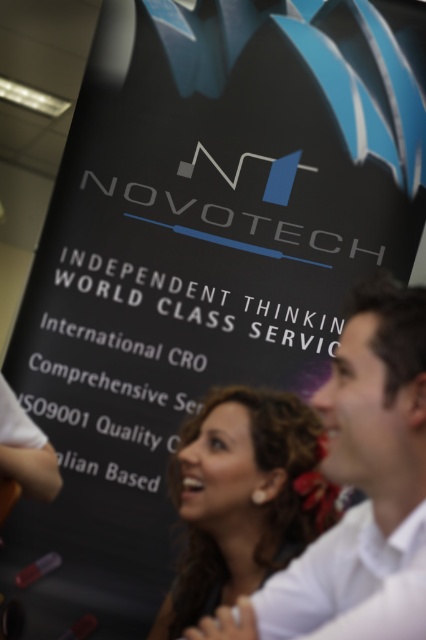
Question: Which point is closer to the camera taking this photo?

Choices:
 (A) (359, 346)
 (B) (229, 474)

Answer: (A)

Question: Observing the image, what is the correct spatial positioning of white shirt at center in reference to curly hair at center?

Choices:
 (A) left
 (B) right

Answer: (B)

Question: Which point is closer to the camera?

Choices:
 (A) (189, 609)
 (B) (371, 307)

Answer: (B)

Question: Considering the relative positions of white shirt at center and curly hair at center in the image provided, where is white shirt at center located with respect to curly hair at center?

Choices:
 (A) left
 (B) right

Answer: (B)

Question: Can you confirm if white shirt at center is wider than curly hair at center?

Choices:
 (A) yes
 (B) no

Answer: (B)

Question: Which object is farther from the camera taking this photo?

Choices:
 (A) curly hair at center
 (B) white shirt at center

Answer: (A)